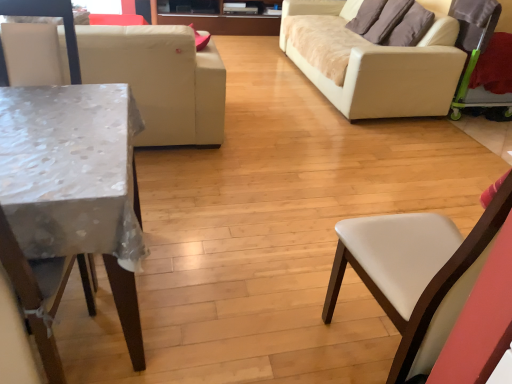
Question: From the image's perspective, is beige fabric studio couch at right, the 2th studio couch in the left-to-right sequence, located beneath brown fabric pillow at upper right, acting as the first pillow starting from the front?

Choices:
 (A) no
 (B) yes

Answer: (A)

Question: Is beige fabric studio couch at right, placed as the 1th studio couch when sorted from right to left, smaller than brown fabric pillow at upper right, which is counted as the 2th pillow, starting from the back?

Choices:
 (A) yes
 (B) no

Answer: (B)

Question: Is beige fabric studio couch at right, the 2th studio couch in the left-to-right sequence, in front of brown fabric pillow at upper right, which is counted as the 2th pillow, starting from the back?

Choices:
 (A) yes
 (B) no

Answer: (A)

Question: From a real-world perspective, is beige fabric studio couch at right, placed as the 1th studio couch when sorted from right to left, below brown fabric pillow at upper right, which is counted as the 2th pillow, starting from the back?

Choices:
 (A) no
 (B) yes

Answer: (B)

Question: Is the surface of beige fabric studio couch at right, placed as the 1th studio couch when sorted from right to left, in direct contact with brown fabric pillow at upper right, which is counted as the 2th pillow, starting from the back?

Choices:
 (A) yes
 (B) no

Answer: (B)

Question: Can you confirm if beige fabric studio couch at right, placed as the 1th studio couch when sorted from right to left, is taller than brown fabric pillow at upper right, which is counted as the 2th pillow, starting from the back?

Choices:
 (A) yes
 (B) no

Answer: (A)

Question: From the image's perspective, would you say white leather chair at left, arranged as the first chair when viewed from the left, is shown under brown fabric pillow at upper right, acting as the first pillow starting from the front?

Choices:
 (A) no
 (B) yes

Answer: (B)

Question: Is white leather chair at left, marked as the 2th chair in a right-to-left arrangement, at the left side of brown fabric pillow at upper right, acting as the first pillow starting from the front?

Choices:
 (A) yes
 (B) no

Answer: (A)

Question: Is white leather chair at left, arranged as the first chair when viewed from the left, thinner than brown fabric pillow at upper right, which is counted as the 2th pillow, starting from the back?

Choices:
 (A) yes
 (B) no

Answer: (B)

Question: Is white leather chair at left, marked as the 2th chair in a right-to-left arrangement, positioned before brown fabric pillow at upper right, which is counted as the 2th pillow, starting from the back?

Choices:
 (A) no
 (B) yes

Answer: (B)

Question: Considering the relative sizes of white leather chair at left, arranged as the first chair when viewed from the left, and brown fabric pillow at upper right, acting as the first pillow starting from the front, in the image provided, is white leather chair at left, arranged as the first chair when viewed from the left, shorter than brown fabric pillow at upper right, acting as the first pillow starting from the front,?

Choices:
 (A) yes
 (B) no

Answer: (B)

Question: Is white leather chair at left, marked as the 2th chair in a right-to-left arrangement, facing away from brown fabric pillow at upper right, acting as the first pillow starting from the front?

Choices:
 (A) no
 (B) yes

Answer: (A)

Question: Is wooden entertainment center at upper center oriented away from white leather chair at right, which is the 1th chair in right-to-left order?

Choices:
 (A) no
 (B) yes

Answer: (A)